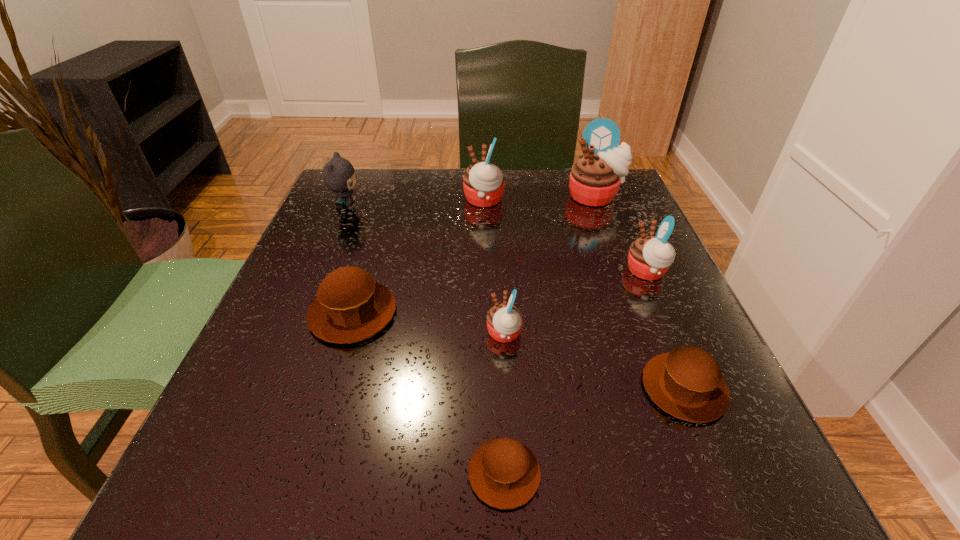
Image resolution: width=960 pixels, height=540 pixels. What are the coordinates of `free space between the second nearest pink muffin and the smallest pink muffin` in the screenshot? It's located at (575, 303).

Select which object is the sixth closest to the smallest brown muffin. Please provide its 2D coordinates. Your answer should be formatted as a tuple, i.e. [(x, y)], where the tuple contains the x and y coordinates of a point satisfying the conditions above.

[(339, 176)]

Identify which object is the third closest to the second tallest object. Please provide its 2D coordinates. Your answer should be formatted as a tuple, i.e. [(x, y)], where the tuple contains the x and y coordinates of a point satisfying the conditions above.

[(350, 306)]

You are a GUI agent. You are given a task and a screenshot of the screen. Output one action in this format:
    pyautogui.click(x=<x>, y=<y>)
    Task: Click on the muffin that is the sixth closest to the biggest brown muffin
    The height and width of the screenshot is (540, 960).
    Given the screenshot: What is the action you would take?
    point(595,178)

Identify the location of muffin that can be found as the fifth closest to the nearest muffin. (483, 183).

Identify which pink muffin is the third nearest to the second biggest pink muffin. Please provide its 2D coordinates. Your answer should be formatted as a tuple, i.e. [(x, y)], where the tuple contains the x and y coordinates of a point satisfying the conditions above.

[(504, 321)]

The width and height of the screenshot is (960, 540). I want to click on the third closest pink muffin to the nearest brown muffin, so click(483, 183).

In order to click on brown muffin that is the closest one to the fifth shortest muffin in this screenshot , I will do `click(687, 383)`.

Choose which brown muffin is the second nearest neighbor to the fifth shortest muffin. Please provide its 2D coordinates. Your answer should be formatted as a tuple, i.e. [(x, y)], where the tuple contains the x and y coordinates of a point satisfying the conditions above.

[(504, 473)]

You are a GUI agent. You are given a task and a screenshot of the screen. Output one action in this format:
    pyautogui.click(x=<x>, y=<y>)
    Task: Click on the free space that satisfies the following two spatial constraints: 1. on the front-facing side of the gray kitten; 2. on the back side of the sixth farthest muffin
    The width and height of the screenshot is (960, 540).
    Given the screenshot: What is the action you would take?
    pyautogui.click(x=270, y=388)